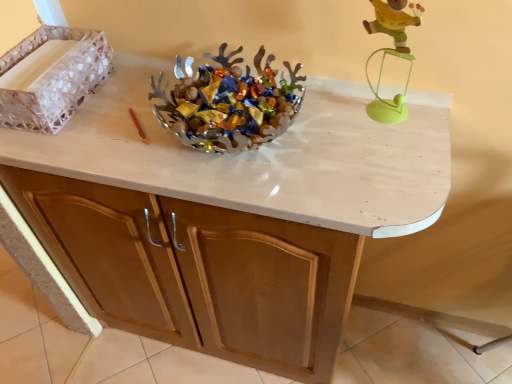
I want to click on unoccupied region to the right of metallic silver bowl at center, so click(x=353, y=136).